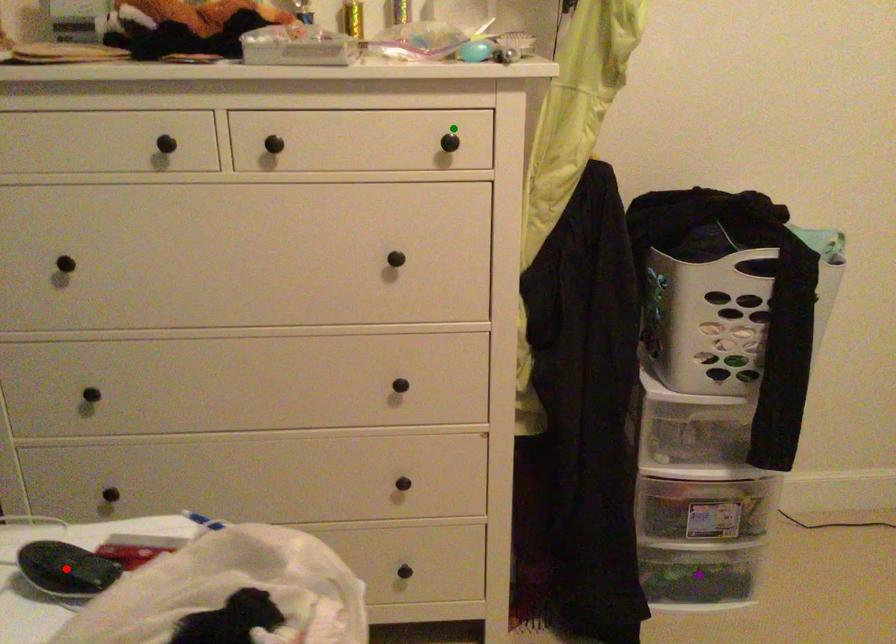
Order these from nearest to farthest:
purple point
green point
red point

purple point, green point, red point